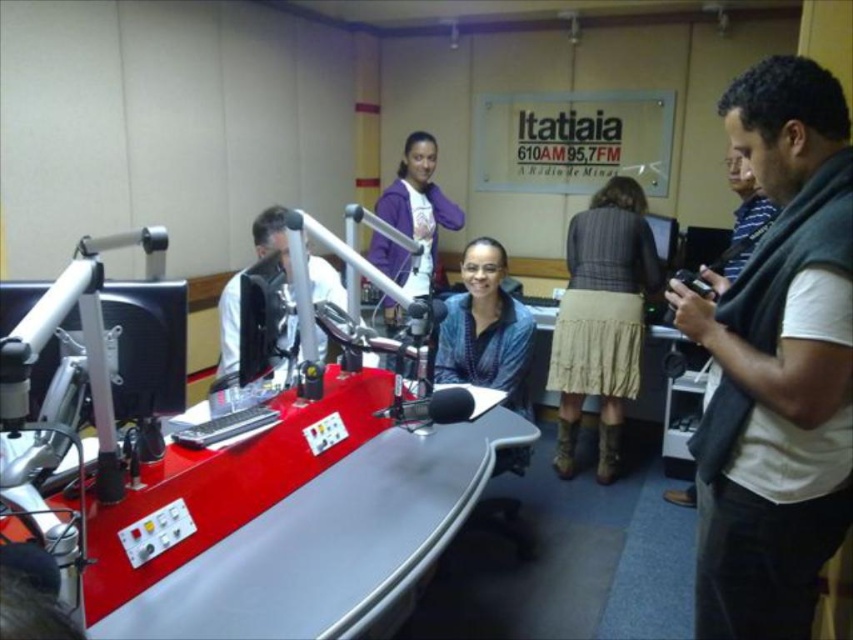
You are a guest entering the radio station studio and want to sit down at the desk. However, you notice two items in the way of your path to the desk. Which item is closer to you, the striped fabric skirt at center or the gray striped sweater at right?

The striped fabric skirt at center is closer to you because the gray striped sweater at right is behind it.

You are a guest in the radio studio and need to sit down. There is a chair at the point labeled as point (776, 364). Is the chair located to the right or left side of the studio?

The point (776, 364) corresponds to the gray sweater at right, so the chair is located on the right side of the studio.